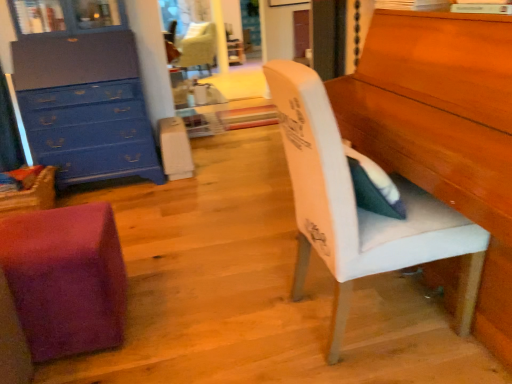
Question: Is velvet cream chair at upper center, the first chair from the top, aimed at purple fuzzy cube at lower left, arranged as the second chair when viewed from the front?

Choices:
 (A) yes
 (B) no

Answer: (B)

Question: Does velvet cream chair at upper center, which is the first chair from back to front, appear on the right side of purple fuzzy cube at lower left, which is counted as the second chair, starting from the right?

Choices:
 (A) yes
 (B) no

Answer: (B)

Question: Does velvet cream chair at upper center, which is the first chair in left-to-right order, have a greater height compared to purple fuzzy cube at lower left, placed as the second chair when sorted from back to front?

Choices:
 (A) no
 (B) yes

Answer: (B)

Question: Is velvet cream chair at upper center, arranged as the 3th chair when viewed from the right, to the left of purple fuzzy cube at lower left, arranged as the second chair when viewed from the front, from the viewer's perspective?

Choices:
 (A) yes
 (B) no

Answer: (A)

Question: Is velvet cream chair at upper center, arranged as the 3th chair when viewed from the right, directly adjacent to purple fuzzy cube at lower left, which is counted as the second chair, starting from the right?

Choices:
 (A) no
 (B) yes

Answer: (A)

Question: From the image's perspective, is white fabric chair at right, placed as the 1th chair when sorted from right to left, positioned above or below velvet cream chair at upper center, which is the first chair from back to front?

Choices:
 (A) above
 (B) below

Answer: (B)

Question: From a real-world perspective, is white fabric chair at right, positioned as the first chair in front-to-back order, positioned above or below velvet cream chair at upper center, the third chair positioned from the front?

Choices:
 (A) above
 (B) below

Answer: (A)

Question: In the image, is white fabric chair at right, which is the third chair from back to front, on the left side or the right side of velvet cream chair at upper center, which is the first chair in left-to-right order?

Choices:
 (A) right
 (B) left

Answer: (A)

Question: Considering the positions of point (333, 251) and point (208, 59), is point (333, 251) closer or farther from the camera than point (208, 59)?

Choices:
 (A) farther
 (B) closer

Answer: (B)

Question: Looking at the image, does velvet cream chair at upper center, the first chair from the top, seem bigger or smaller compared to blue painted wood chest of drawers at upper left?

Choices:
 (A) big
 (B) small

Answer: (A)

Question: Would you say velvet cream chair at upper center, which is the first chair from back to front, is inside or outside blue painted wood chest of drawers at upper left?

Choices:
 (A) outside
 (B) inside

Answer: (A)

Question: Relative to blue painted wood chest of drawers at upper left, is velvet cream chair at upper center, which is the first chair from back to front, in front or behind?

Choices:
 (A) behind
 (B) front

Answer: (A)

Question: In terms of height, does velvet cream chair at upper center, arranged as the 3th chair when viewed from the right, look taller or shorter compared to blue painted wood chest of drawers at upper left?

Choices:
 (A) tall
 (B) short

Answer: (B)

Question: Considering the positions of blue painted wood chest of drawers at upper left and purple fuzzy cube at lower left, the 2th chair when ordered from left to right, in the image, is blue painted wood chest of drawers at upper left wider or thinner than purple fuzzy cube at lower left, the 2th chair when ordered from left to right,?

Choices:
 (A) wide
 (B) thin

Answer: (A)

Question: From a real-world perspective, is blue painted wood chest of drawers at upper left positioned above or below purple fuzzy cube at lower left, placed as the second chair when sorted from back to front?

Choices:
 (A) below
 (B) above

Answer: (B)